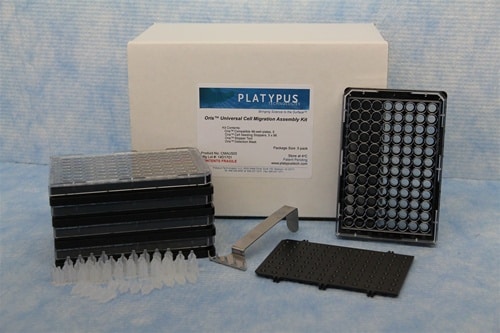
Image resolution: width=500 pixels, height=333 pixels. What are the coordinates of `table` in the screenshot? It's located at (470, 226).